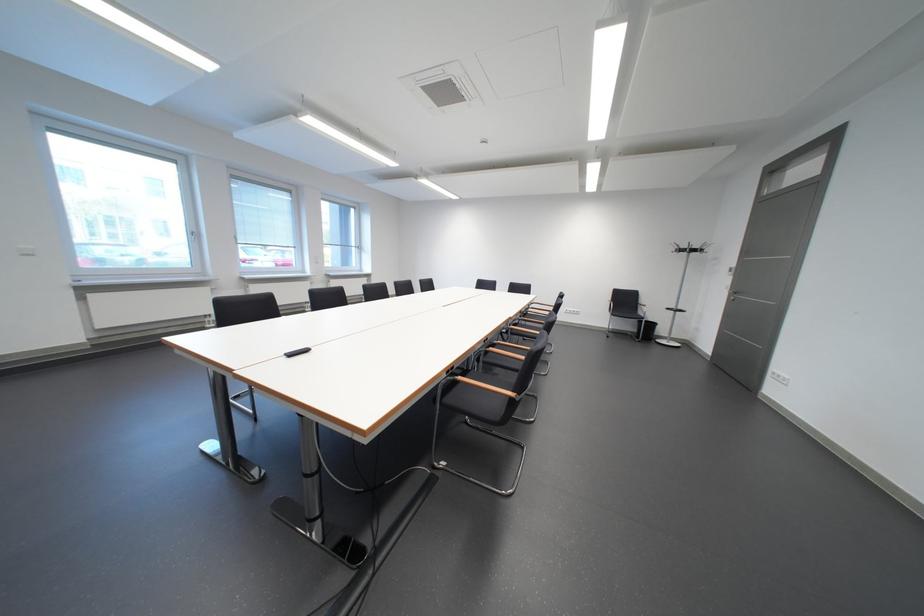
Describe the element at coordinates (689, 248) in the screenshot. I see `a coat stand hook` at that location.